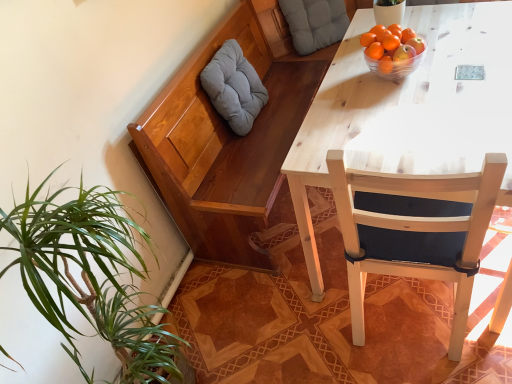
Locate an element on the screen. Image resolution: width=512 pixels, height=384 pixels. orange matte at upper right is located at coordinates (375, 50).

How much space does gray fabric pillow at upper left, positioned as the 2th pillow in top-to-bottom order, occupy vertically?

gray fabric pillow at upper left, positioned as the 2th pillow in top-to-bottom order, is 19.20 inches in height.

What do you see at coordinates (394, 66) in the screenshot? I see `transparent glass bowl at upper right` at bounding box center [394, 66].

Where is `orange matte tangerine at upper right`? orange matte tangerine at upper right is located at coordinates (390, 42).

In the scene shown: Is the position of transparent glass bowl at upper right more distant than that of orange matte at upper right?

No, the depth of transparent glass bowl at upper right is less than that of orange matte at upper right.

Is transparent glass bowl at upper right at the right side of orange matte at upper right?

Correct, you'll find transparent glass bowl at upper right to the right of orange matte at upper right.

How different are the orientations of transparent glass bowl at upper right and orange matte at upper right in degrees?

0.000144 degrees separate the facing orientations of transparent glass bowl at upper right and orange matte at upper right.

Are transparent glass bowl at upper right and orange matte at upper right making contact?

Absolutely, transparent glass bowl at upper right is next to and touching orange matte at upper right.

The height and width of the screenshot is (384, 512). I want to click on tangerine above the transparent glass bowl at upper right (from a real-world perspective), so [390, 42].

Measure the distance between transparent glass bowl at upper right and orange matte tangerine at upper right.

transparent glass bowl at upper right is 3.57 inches from orange matte tangerine at upper right.

From the picture: Can you confirm if transparent glass bowl at upper right is positioned to the left of orange matte tangerine at upper right?

Incorrect, transparent glass bowl at upper right is not on the left side of orange matte tangerine at upper right.

Which object is thinner, transparent glass bowl at upper right or orange matte tangerine at upper right?

orange matte tangerine at upper right.

Which is more to the left, gray fabric pillow at upper left, positioned as the 2th pillow in top-to-bottom order, or transparent glass bowl at upper right?

From the viewer's perspective, gray fabric pillow at upper left, positioned as the 2th pillow in top-to-bottom order, appears more on the left side.

Is gray fabric pillow at upper left, arranged as the 1th pillow when ordered from the bottom, bigger than transparent glass bowl at upper right?

Yes, gray fabric pillow at upper left, arranged as the 1th pillow when ordered from the bottom, is bigger than transparent glass bowl at upper right.

Between gray fabric pillow at upper left, which is the second pillow in right-to-left order, and transparent glass bowl at upper right, which one is positioned behind?

gray fabric pillow at upper left, which is the second pillow in right-to-left order, is further from the camera.

The height and width of the screenshot is (384, 512). I want to click on bowl in front of the gray fabric pillow at upper left, which is the first pillow from left to right, so click(x=394, y=66).

From the image's perspective, which one is positioned lower, transparent glass bowl at upper right or gray fabric pillow at upper left, positioned as the 2th pillow in top-to-bottom order?

From the image's view, transparent glass bowl at upper right is below.

Is gray fabric pillow at upper left, which is the second pillow in right-to-left order, at the back of transparent glass bowl at upper right?

Yes.

Based on the photo, can you confirm if transparent glass bowl at upper right is wider than gray fabric pillow at upper left, which is the second pillow in right-to-left order?

Yes.

Would you say transparent glass bowl at upper right contains gray fabric pillow at upper left, arranged as the 1th pillow when ordered from the bottom?

No, gray fabric pillow at upper left, arranged as the 1th pillow when ordered from the bottom, is not inside transparent glass bowl at upper right.

Looking at this image, who is taller, orange matte tangerine at upper right or wooden chair at right?

Standing taller between the two is wooden chair at right.

In the scene shown: Between orange matte tangerine at upper right and wooden chair at right, which one has smaller size?

Smaller between the two is orange matte tangerine at upper right.

Measure the distance from orange matte tangerine at upper right to wooden chair at right.

orange matte tangerine at upper right and wooden chair at right are 29.27 inches apart from each other.

Would you say orange matte tangerine at upper right is outside wooden chair at right?

Yes.

Between point (397, 79) and point (397, 260), which one is positioned behind?

Positioned behind is point (397, 79).

At what (x,y) coordinates should I click in order to perform the action: click on chair to the right of transparent glass bowl at upper right. Please return your answer as a coordinate pair (x, y). Looking at the image, I should click on coord(414,230).

In the scene shown: Considering the sizes of objects transparent glass bowl at upper right and wooden chair at right in the image provided, who is shorter, transparent glass bowl at upper right or wooden chair at right?

With less height is transparent glass bowl at upper right.

In the scene shown: Which object is positioned more to the right, transparent glass bowl at upper right or wooden chair at right?

Positioned to the right is wooden chair at right.

Is wooden chair at right surrounding orange matte at upper right?

No, wooden chair at right does not contain orange matte at upper right.

Which object is further away from the camera taking this photo, wooden chair at right or orange matte at upper right?

orange matte at upper right is more distant.

Considering the positions of objects wooden chair at right and orange matte at upper right in the image provided, who is more to the right, wooden chair at right or orange matte at upper right?

From the viewer's perspective, wooden chair at right appears more on the right side.

Image resolution: width=512 pixels, height=384 pixels. Find the location of `orange positioned vertically above the transparent glass bowl at upper right (from a real-world perspective)`. orange positioned vertically above the transparent glass bowl at upper right (from a real-world perspective) is located at coordinates (375, 50).

Find the location of a particular element. The width and height of the screenshot is (512, 384). tangerine located behind the transparent glass bowl at upper right is located at coordinates (390, 42).

Based on their spatial positions, is orange matte at upper right or wooden chair at right closer to orange matte tangerine at upper right?

orange matte at upper right lies closer to orange matte tangerine at upper right than the other object.

From the image, which object appears to be farther from gray fabric pillow at upper left, which is the first pillow from left to right, orange matte at upper right or orange matte tangerine at upper right?

orange matte tangerine at upper right is positioned further to the anchor gray fabric pillow at upper left, which is the first pillow from left to right.

Based on their spatial positions, is wooden chair at right or orange matte at upper right closer to gray fabric pillow at upper left, arranged as the 1th pillow when ordered from the bottom?

Among the two, orange matte at upper right is located nearer to gray fabric pillow at upper left, arranged as the 1th pillow when ordered from the bottom.

Estimate the real-world distances between objects in this image. Which object is further from wooden chair at right, gray fabric pillow at upper left, which is the second pillow in right-to-left order, or orange matte tangerine at upper right?

Among the two, gray fabric pillow at upper left, which is the second pillow in right-to-left order, is located further to wooden chair at right.

Estimate the real-world distances between objects in this image. Which object is further from wooden chair at right, gray fabric pillow at upper left, which is the first pillow from left to right, or transparent glass bowl at upper right?

The object further to wooden chair at right is gray fabric pillow at upper left, which is the first pillow from left to right.

From the image, which object appears to be farther from wooden chair at right, orange matte at upper right or gray fabric pillow at upper center, the first pillow from the right?

gray fabric pillow at upper center, the first pillow from the right.

From the image, which object appears to be nearer to gray fabric pillow at upper left, which is the first pillow from left to right, wooden chair at right or orange matte tangerine at upper right?

Among the two, orange matte tangerine at upper right is located nearer to gray fabric pillow at upper left, which is the first pillow from left to right.

Based on their spatial positions, is transparent glass bowl at upper right or gray fabric pillow at upper left, which is the first pillow from left to right, closer to orange matte tangerine at upper right?

The object closer to orange matte tangerine at upper right is transparent glass bowl at upper right.

I want to click on orange between wooden chair at right and orange matte tangerine at upper right along the z-axis, so click(375, 50).

This screenshot has height=384, width=512. In order to click on pillow positioned between transparent glass bowl at upper right and gray fabric pillow at upper center, the first pillow from the right, from near to far in this screenshot , I will do (x=234, y=87).

The height and width of the screenshot is (384, 512). I want to click on orange between gray fabric pillow at upper left, which is the second pillow in right-to-left order, and transparent glass bowl at upper right, in the horizontal direction, so click(x=375, y=50).

This screenshot has height=384, width=512. In order to click on pillow between wooden chair at right and gray fabric pillow at upper center, arranged as the second pillow when viewed from the left, along the z-axis in this screenshot , I will do [234, 87].